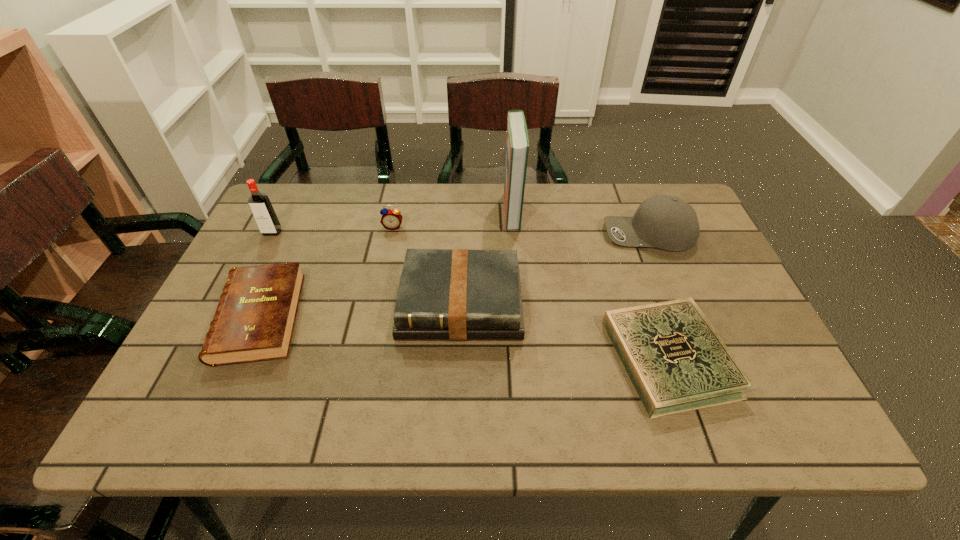
I want to click on the tallest hardback book, so click(517, 144).

Find the location of a particular element. This screenshot has width=960, height=540. the farthest hardback book is located at coordinates (517, 144).

The width and height of the screenshot is (960, 540). I want to click on vodka, so click(260, 205).

Where is `the fifth shortest object`? The width and height of the screenshot is (960, 540). the fifth shortest object is located at coordinates (666, 222).

Find the location of `alarm clock`. alarm clock is located at coordinates (391, 219).

I want to click on the second tallest hardback book, so click(x=444, y=294).

At what (x,y) coordinates should I click in order to perform the action: click on the third tallest hardback book. Please return your answer as a coordinate pair (x, y). Image resolution: width=960 pixels, height=540 pixels. Looking at the image, I should click on (254, 321).

Find the location of `the leftmost hardback book`. the leftmost hardback book is located at coordinates (254, 321).

Find the location of a particular element. Image resolution: width=960 pixels, height=540 pixels. the shortest object is located at coordinates coord(676,361).

At what (x,y) coordinates should I click in order to perform the action: click on the rightmost hardback book. Please return your answer as a coordinate pair (x, y). The width and height of the screenshot is (960, 540). Looking at the image, I should click on (676, 361).